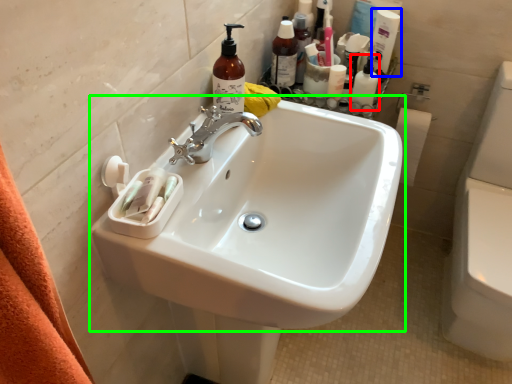
Question: Which object is positioned farthest from toiletry (highlighted by a red box)? Select from cleaning product (highlighted by a blue box) and sink (highlighted by a green box).

Choices:
 (A) cleaning product
 (B) sink

Answer: (B)